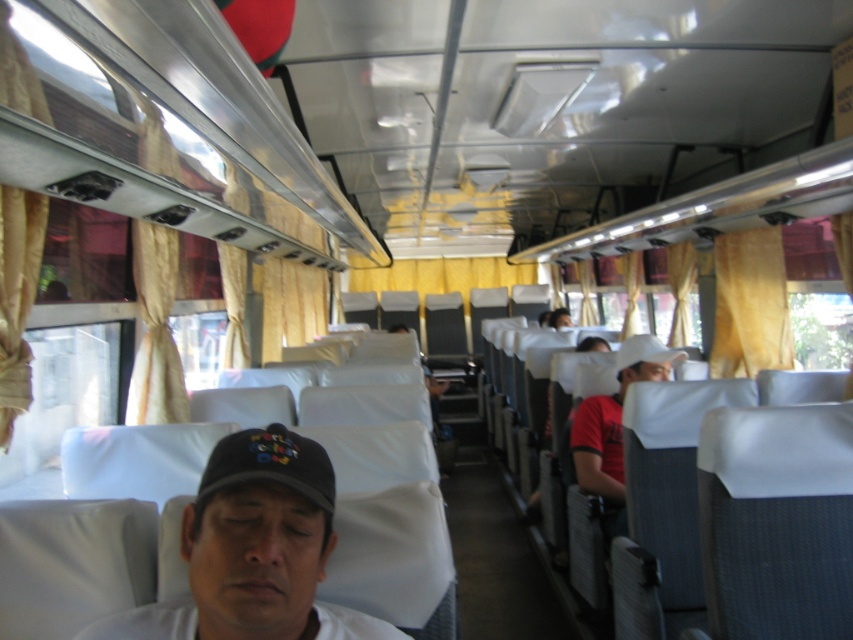
Which is behind, point (149, 620) or point (769, 234)?

The point (769, 234) is behind.

Locate an element on the screen. The height and width of the screenshot is (640, 853). white matte cap at center is located at coordinates (254, 550).

What are the coordinates of `white matte cap at center` in the screenshot? It's located at (254, 550).

Who is taller, white matte cap at center or white matte baseball cap at center?

With more height is white matte cap at center.

Can you confirm if white matte cap at center is positioned to the left of white matte baseball cap at center?

Indeed, white matte cap at center is positioned on the left side of white matte baseball cap at center.

This screenshot has width=853, height=640. What do you see at coordinates (254, 550) in the screenshot?
I see `white matte cap at center` at bounding box center [254, 550].

I want to click on white matte cap at center, so pos(254,550).

Is yellow fabric curtain at right wider than white matte baseball cap at center?

Yes, yellow fabric curtain at right is wider than white matte baseball cap at center.

Is yellow fabric curtain at right taller than white matte baseball cap at center?

Yes.

Locate an element on the screen. The width and height of the screenshot is (853, 640). yellow fabric curtain at right is located at coordinates (750, 305).